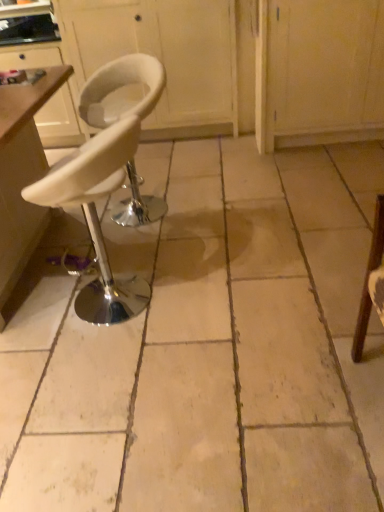
Identify the location of free space behind white matte stool at left, the second chair in the back-to-front sequence. (150, 244).